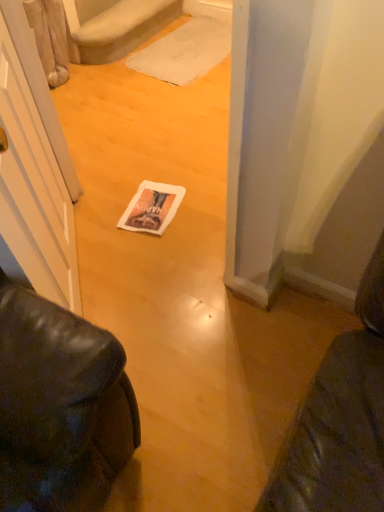
Question: Can you confirm if white plush carpet at upper center is smaller than white paper magazine at center?

Choices:
 (A) yes
 (B) no

Answer: (B)

Question: Does white plush carpet at upper center have a lesser height compared to white paper magazine at center?

Choices:
 (A) no
 (B) yes

Answer: (A)

Question: Is white plush carpet at upper center facing away from white paper magazine at center?

Choices:
 (A) no
 (B) yes

Answer: (A)

Question: Is white plush carpet at upper center at the left side of white paper magazine at center?

Choices:
 (A) yes
 (B) no

Answer: (A)

Question: Does white plush carpet at upper center have a larger size compared to white paper magazine at center?

Choices:
 (A) no
 (B) yes

Answer: (B)

Question: Considering the relative sizes of white plush carpet at upper center and white paper magazine at center in the image provided, is white plush carpet at upper center wider than white paper magazine at center?

Choices:
 (A) yes
 (B) no

Answer: (B)

Question: From a real-world perspective, does white plush carpet at upper center sit lower than white fabric doormat at center?

Choices:
 (A) no
 (B) yes

Answer: (A)

Question: Is the surface of white plush carpet at upper center in direct contact with white fabric doormat at center?

Choices:
 (A) yes
 (B) no

Answer: (B)

Question: Is white plush carpet at upper center positioned far away from white fabric doormat at center?

Choices:
 (A) no
 (B) yes

Answer: (A)

Question: Is white plush carpet at upper center turned away from white fabric doormat at center?

Choices:
 (A) no
 (B) yes

Answer: (A)

Question: Is white plush carpet at upper center at the right side of white fabric doormat at center?

Choices:
 (A) yes
 (B) no

Answer: (B)

Question: From the image's perspective, is white plush carpet at upper center above white fabric doormat at center?

Choices:
 (A) no
 (B) yes

Answer: (B)

Question: From a real-world perspective, is white paper magazine at center positioned over white fabric doormat at center based on gravity?

Choices:
 (A) yes
 (B) no

Answer: (B)